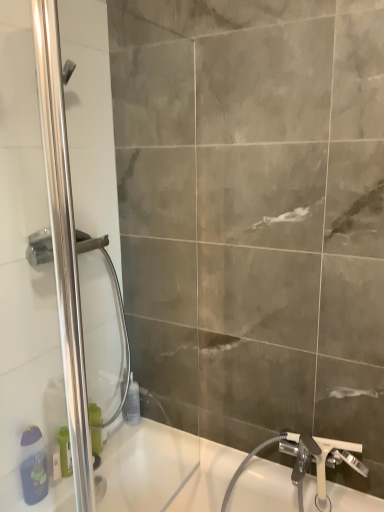
Question: Is the surface of white plastic bottle at lower left, which is counted as the third toiletry, starting from the right, in direct contact with white glossy bathtub at lower left?

Choices:
 (A) yes
 (B) no

Answer: (B)

Question: From a real-world perspective, is white plastic bottle at lower left, which is the second toiletry in left-to-right order, located beneath white glossy bathtub at lower left?

Choices:
 (A) no
 (B) yes

Answer: (A)

Question: Is white plastic bottle at lower left, which is counted as the third toiletry, starting from the right, further to camera compared to white glossy bathtub at lower left?

Choices:
 (A) yes
 (B) no

Answer: (A)

Question: From the image's perspective, is white plastic bottle at lower left, which is counted as the third toiletry, starting from the right, below white glossy bathtub at lower left?

Choices:
 (A) yes
 (B) no

Answer: (B)

Question: From a real-world perspective, is white plastic bottle at lower left, which is the second toiletry in left-to-right order, physically above white glossy bathtub at lower left?

Choices:
 (A) yes
 (B) no

Answer: (A)

Question: Considering the positions of polished stainless steel shower door at left and transparent plastic bottle at lower center, acting as the first toiletry starting from the right, in the image, is polished stainless steel shower door at left bigger or smaller than transparent plastic bottle at lower center, acting as the first toiletry starting from the right,?

Choices:
 (A) small
 (B) big

Answer: (B)

Question: Considering the positions of polished stainless steel shower door at left and transparent plastic bottle at lower center, acting as the first toiletry starting from the right, in the image, is polished stainless steel shower door at left taller or shorter than transparent plastic bottle at lower center, acting as the first toiletry starting from the right,?

Choices:
 (A) tall
 (B) short

Answer: (A)

Question: In the image, is polished stainless steel shower door at left on the left side or the right side of transparent plastic bottle at lower center, acting as the first toiletry starting from the right?

Choices:
 (A) right
 (B) left

Answer: (B)

Question: Is polished stainless steel shower door at left wider or thinner than transparent plastic bottle at lower center, acting as the first toiletry starting from the right?

Choices:
 (A) wide
 (B) thin

Answer: (B)

Question: From their relative heights in the image, would you say white plastic tap at lower right is taller or shorter than green plastic bottle at lower left, which ranks as the 2th toiletry in back-to-front order?

Choices:
 (A) short
 (B) tall

Answer: (B)

Question: From the image's perspective, is white plastic tap at lower right located above or below green plastic bottle at lower left, which ranks as the 2th toiletry in back-to-front order?

Choices:
 (A) above
 (B) below

Answer: (B)

Question: Choose the correct answer: Is white plastic tap at lower right inside green plastic bottle at lower left, acting as the 3th toiletry starting from the left, or outside it?

Choices:
 (A) inside
 (B) outside

Answer: (B)

Question: Visually, is white plastic tap at lower right positioned to the left or to the right of green plastic bottle at lower left, acting as the 3th toiletry starting from the left?

Choices:
 (A) left
 (B) right

Answer: (B)

Question: In the image, is white plastic tap at lower right positioned in front of or behind white glossy bathtub at lower left?

Choices:
 (A) front
 (B) behind

Answer: (B)

Question: From a real-world perspective, is white plastic tap at lower right positioned above or below white glossy bathtub at lower left?

Choices:
 (A) above
 (B) below

Answer: (A)